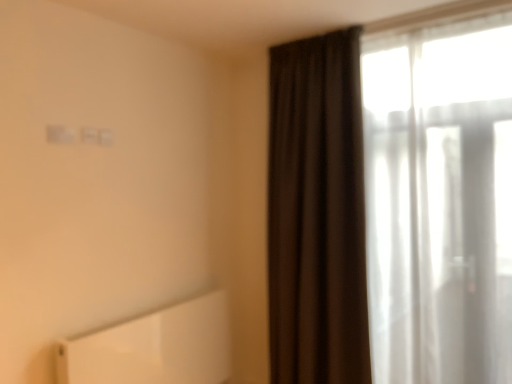
In order to face white sheer curtain at right, should I rotate leftwards or rightwards?

A 20.704 degree turn to the right will do.

Describe the element at coordinates (397, 201) in the screenshot. I see `white sheer curtain at right` at that location.

I want to click on white sheer curtain at right, so click(397, 201).

In order to click on white sheer curtain at right in this screenshot , I will do `click(397, 201)`.